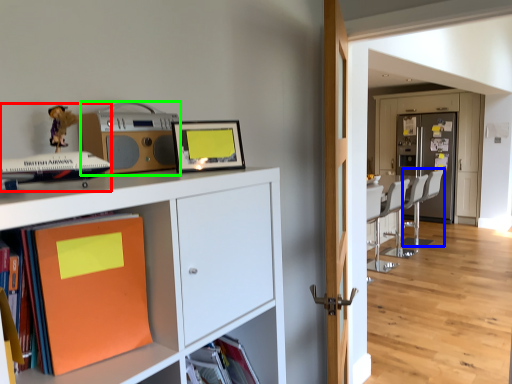
Question: Considering the real-world distances, which object is closest to toy (highlighted by a red box)? swivel chair (highlighted by a blue box) or stereo (highlighted by a green box).

Choices:
 (A) swivel chair
 (B) stereo

Answer: (B)